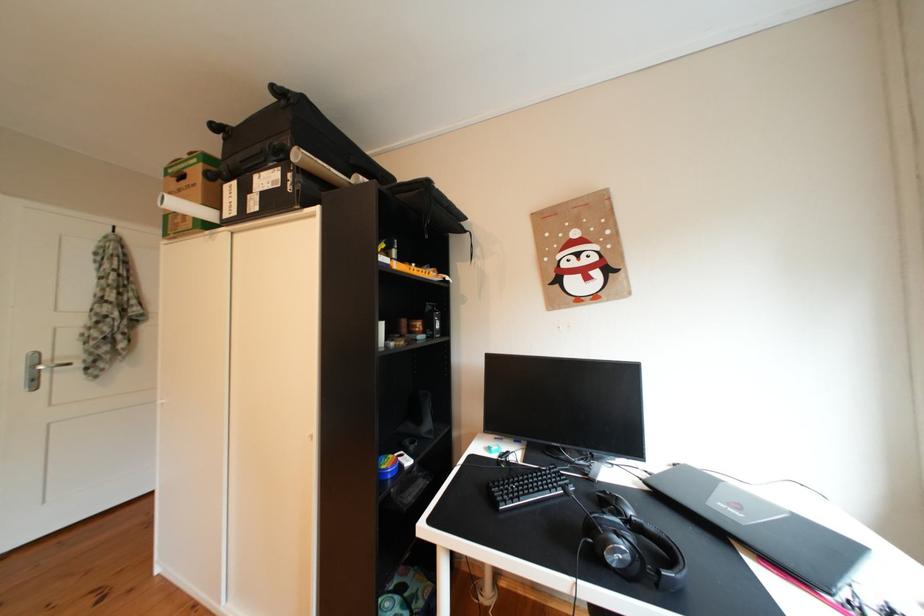
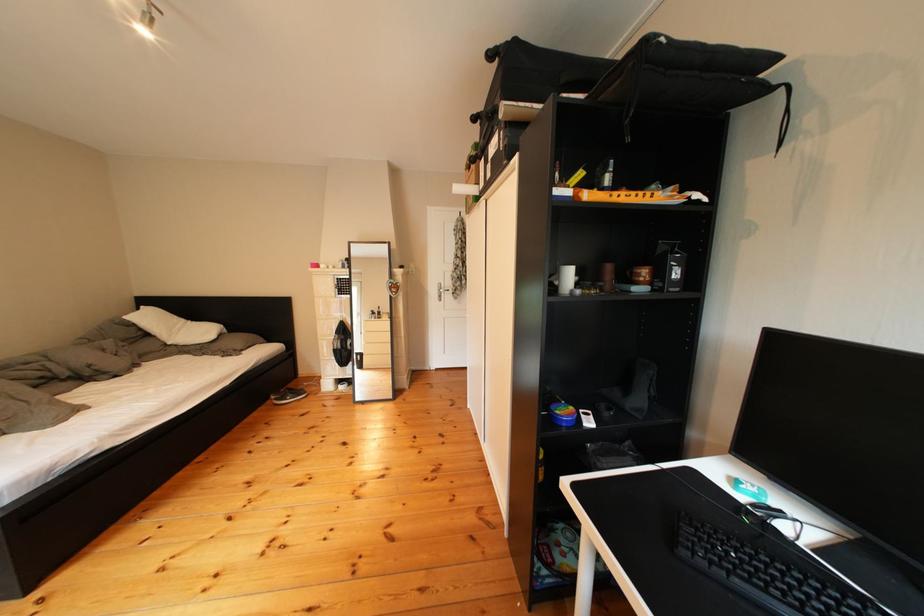
Question: How did the camera likely rotate?

Choices:
 (A) Left
 (B) Right
 (C) Up
 (D) Down

Answer: (A)